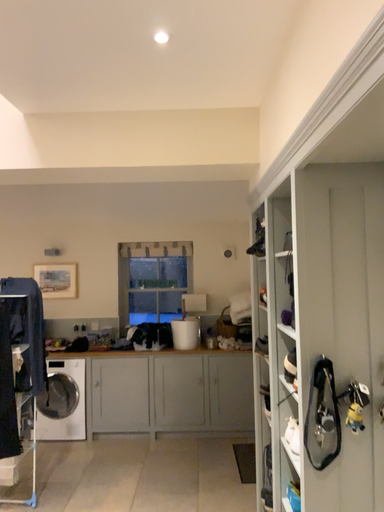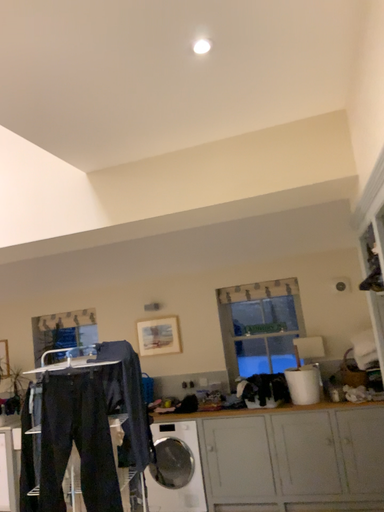
Question: How did the camera likely rotate when shooting the video?

Choices:
 (A) rotated left
 (B) rotated right

Answer: (A)